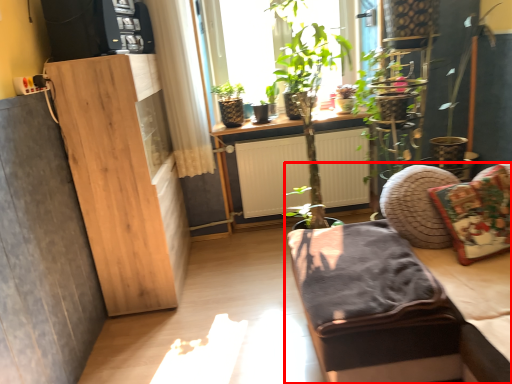
Question: In this image, where is studio couch (annotated by the red box) located relative to pillow?

Choices:
 (A) right
 (B) left

Answer: (B)